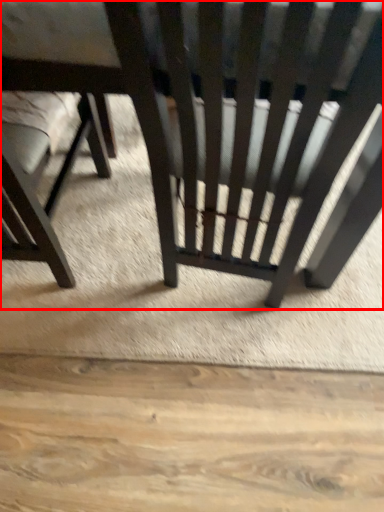
Question: From the image's perspective, where is chair (annotated by the red box) located in relation to chair in the image?

Choices:
 (A) above
 (B) below

Answer: (A)